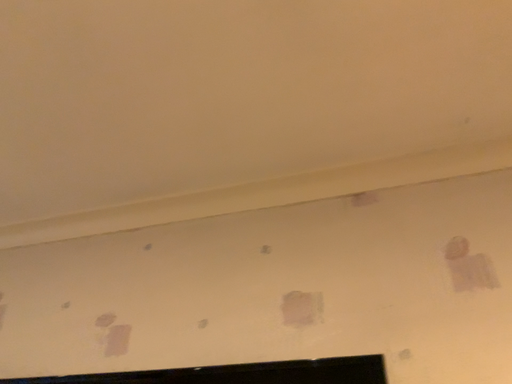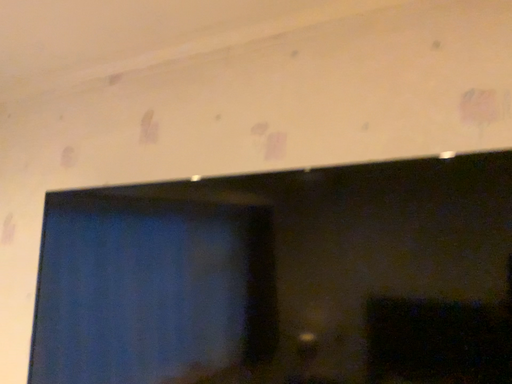
Question: Which way did the camera rotate in the video?

Choices:
 (A) rotated right
 (B) rotated left

Answer: (B)